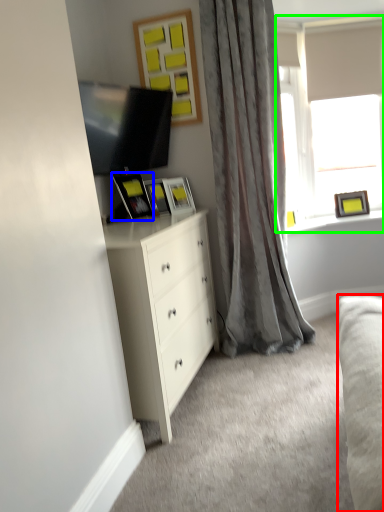
Question: Based on their relative distances, which object is nearer to studio couch (highlighted by a red box)? Choose from picture frame (highlighted by a blue box) and window (highlighted by a green box).

Choices:
 (A) picture frame
 (B) window

Answer: (A)